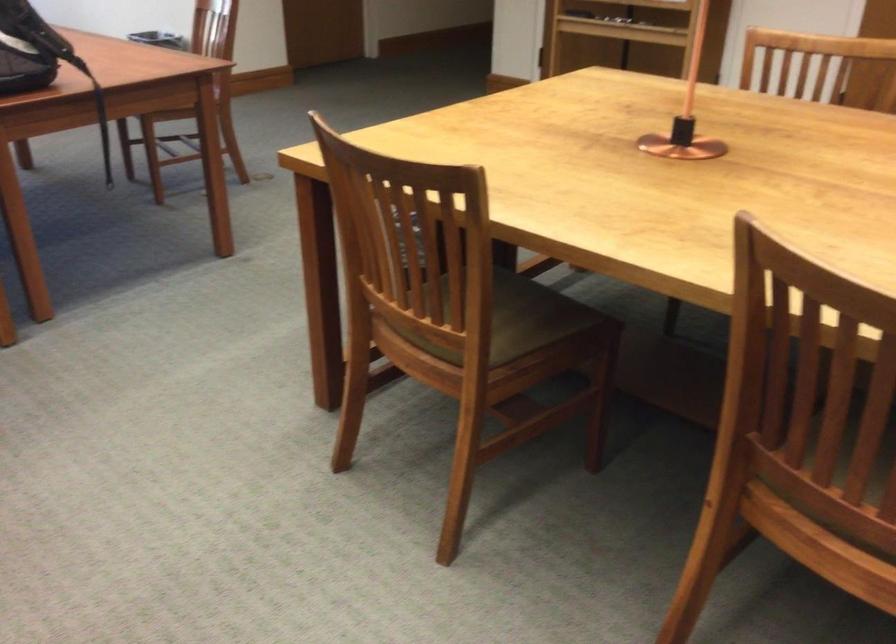
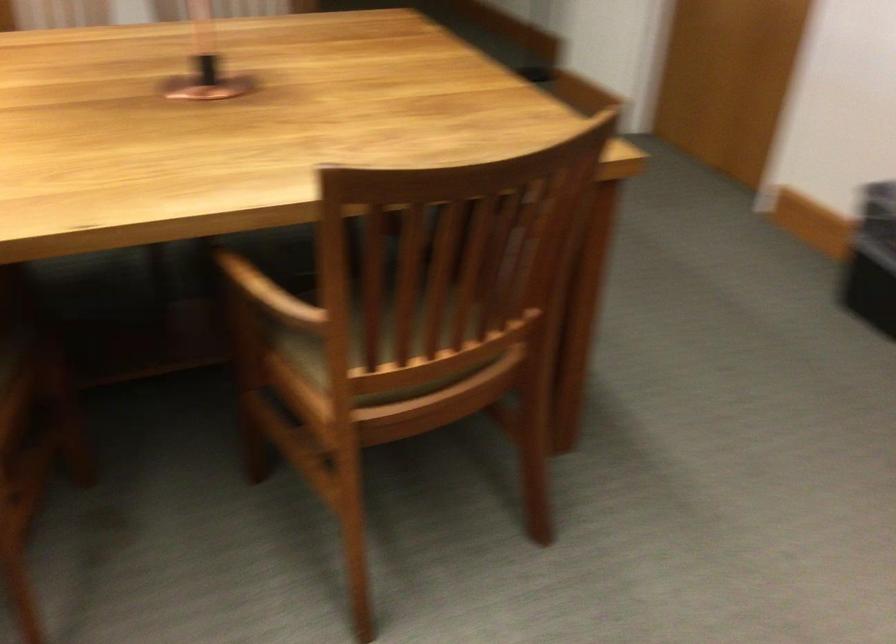
The first image is from the beginning of the video and the second image is from the end. How did the camera likely rotate when shooting the video?

The rotation direction of the camera is right-down.